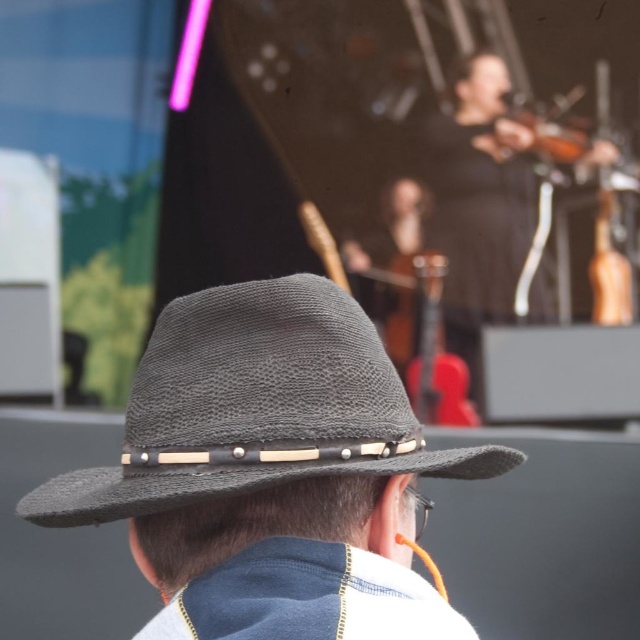
Question: Can you confirm if black woven hat at center is thinner than faded denim jacket at lower right?

Choices:
 (A) no
 (B) yes

Answer: (A)

Question: Which point is farther to the camera?

Choices:
 (A) (205, 387)
 (B) (371, 566)

Answer: (A)

Question: Is black woven hat at center positioned behind faded denim jacket at lower right?

Choices:
 (A) no
 (B) yes

Answer: (B)

Question: Which object is closer to the camera taking this photo?

Choices:
 (A) black woven hat at center
 (B) faded denim jacket at lower right

Answer: (B)

Question: Which object appears farthest from the camera in this image?

Choices:
 (A) black woven hat at center
 (B) faded denim jacket at lower right

Answer: (A)

Question: From the image, what is the correct spatial relationship of black woven hat at center in relation to faded denim jacket at lower right?

Choices:
 (A) left
 (B) right

Answer: (A)